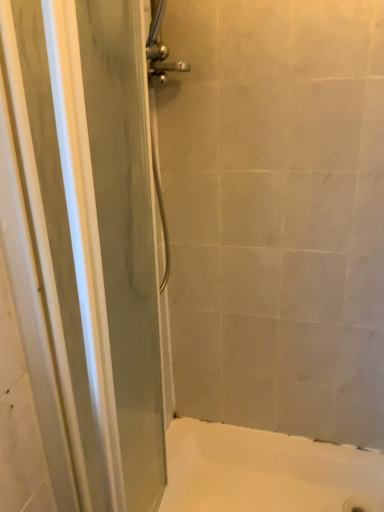
Question: Is point (367, 507) closer or farther from the camera than point (112, 32)?

Choices:
 (A) farther
 (B) closer

Answer: (A)

Question: Considering the positions of white smooth bathtub at lower center and transparent glass screen door at left in the image, is white smooth bathtub at lower center wider or thinner than transparent glass screen door at left?

Choices:
 (A) thin
 (B) wide

Answer: (B)

Question: Choose the correct answer: Is white smooth bathtub at lower center inside transparent glass screen door at left or outside it?

Choices:
 (A) outside
 (B) inside

Answer: (A)

Question: Based on their positions, is transparent glass screen door at left located to the left or right of white smooth bathtub at lower center?

Choices:
 (A) left
 (B) right

Answer: (A)

Question: In terms of width, does transparent glass screen door at left look wider or thinner when compared to white smooth bathtub at lower center?

Choices:
 (A) wide
 (B) thin

Answer: (B)

Question: From their relative heights in the image, would you say transparent glass screen door at left is taller or shorter than white smooth bathtub at lower center?

Choices:
 (A) short
 (B) tall

Answer: (B)

Question: From a real-world perspective, is transparent glass screen door at left positioned above or below white smooth bathtub at lower center?

Choices:
 (A) below
 (B) above

Answer: (B)